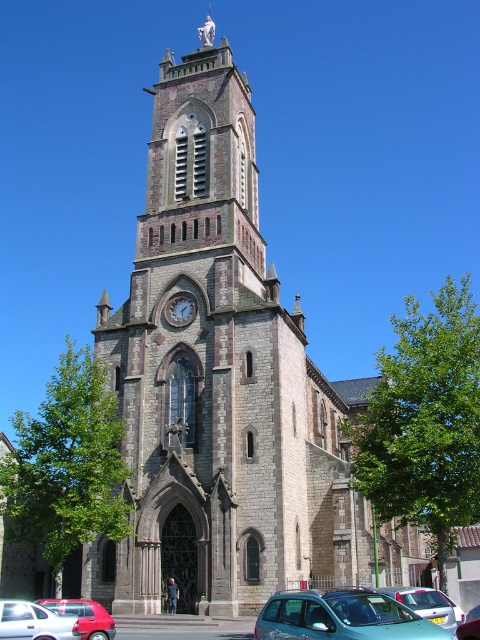
Question: Does brown stone church at center have a smaller size compared to matte red car at lower left?

Choices:
 (A) yes
 (B) no

Answer: (B)

Question: Which of the following is the farthest from the observer?

Choices:
 (A) metallic silver car at lower right
 (B) white matte car at lower left
 (C) brown stone church at center
 (D) metallic silver car at center

Answer: (C)

Question: Does white matte car at lower left have a smaller size compared to matte red car at lower left?

Choices:
 (A) no
 (B) yes

Answer: (A)

Question: Among these points, which one is nearest to the camera?

Choices:
 (A) (457, 628)
 (B) (184, 253)
 (C) (188, 314)

Answer: (A)

Question: Considering the relative positions of metallic silver car at center and matte gray clock at center in the image provided, where is metallic silver car at center located with respect to matte gray clock at center?

Choices:
 (A) below
 (B) above

Answer: (A)

Question: Which object is farther from the camera taking this photo?

Choices:
 (A) metallic silver car at lower right
 (B) white matte car at lower left
 (C) brown stone church at center

Answer: (C)